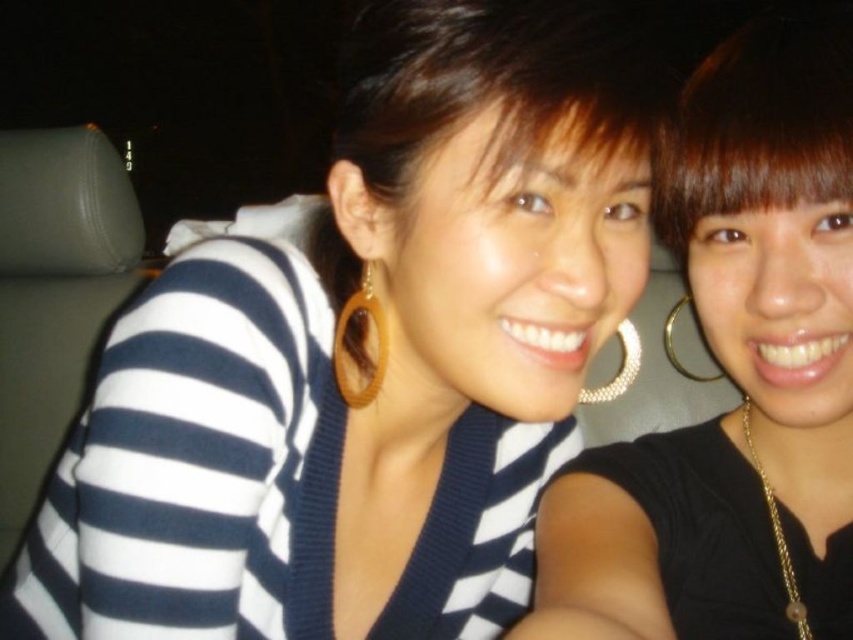
You are a photographer setting up a shot for a magazine cover. You need to ensure that the matte black sweater at center and the brown hair at upper right are both visible in the frame. Based on their sizes, which object should you focus on to ensure both are in focus?

The matte black sweater at center is much taller than the brown hair at upper right, so focusing on the sweater would ensure both are in focus since it is larger and positioned centrally.

In the scene shown: You are a photographer adjusting the focus of your camera. You need to ensure both the matte black sweater at center and the brown hair at upper right are in focus. Based on their positions, which one should you focus on first to achieve depth of field?

The matte black sweater at center is located below the brown hair at upper right. To achieve depth of field, you should focus on the brown hair at upper right first since it is closer to the camera than the matte black sweater at center.

You are trying to locate the matte black sweater at center in the image. Given that the coordinate system starts at the bottom left corner of the image with coordinates 0,0, can you determine whether the point (735,376) is located to the left or right of the matte black sweater at center?

The point (735,376) corresponds to the matte black sweater at center, so it is exactly at the location of the matte black sweater at center.